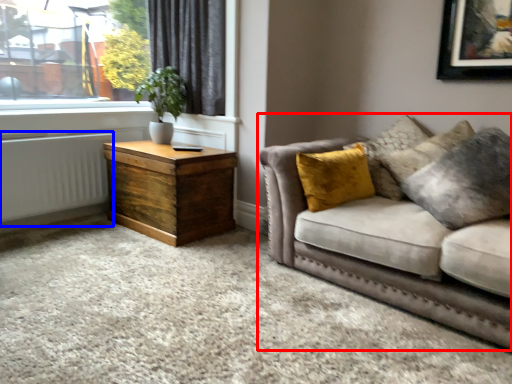
Question: Which of the following is the closest to the observer, studio couch (highlighted by a red box) or radiator (highlighted by a blue box)?

Choices:
 (A) studio couch
 (B) radiator

Answer: (A)